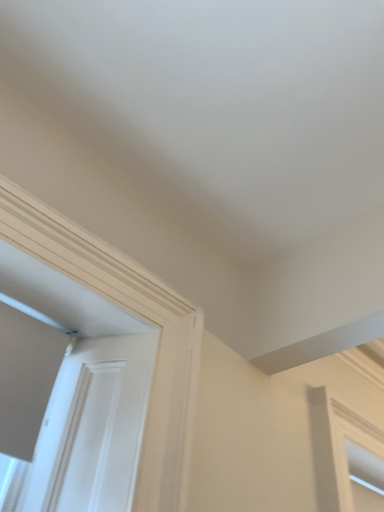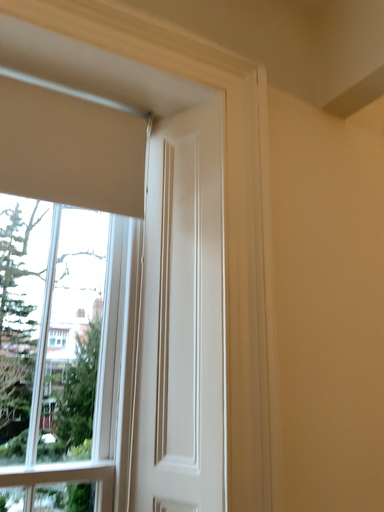
Question: How did the camera likely rotate when shooting the video?

Choices:
 (A) rotated right
 (B) rotated left

Answer: (B)